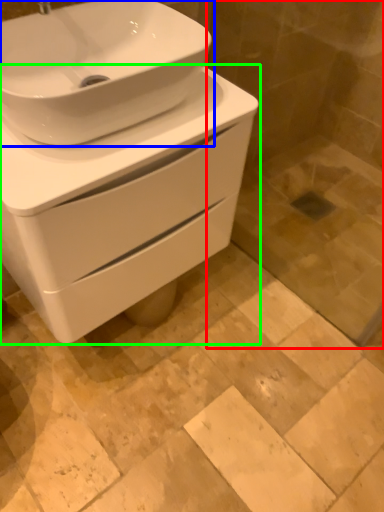
Question: Which object is positioned farthest from glass door (highlighted by a red box)? Select from sink (highlighted by a blue box) and toilet (highlighted by a green box).

Choices:
 (A) sink
 (B) toilet

Answer: (A)